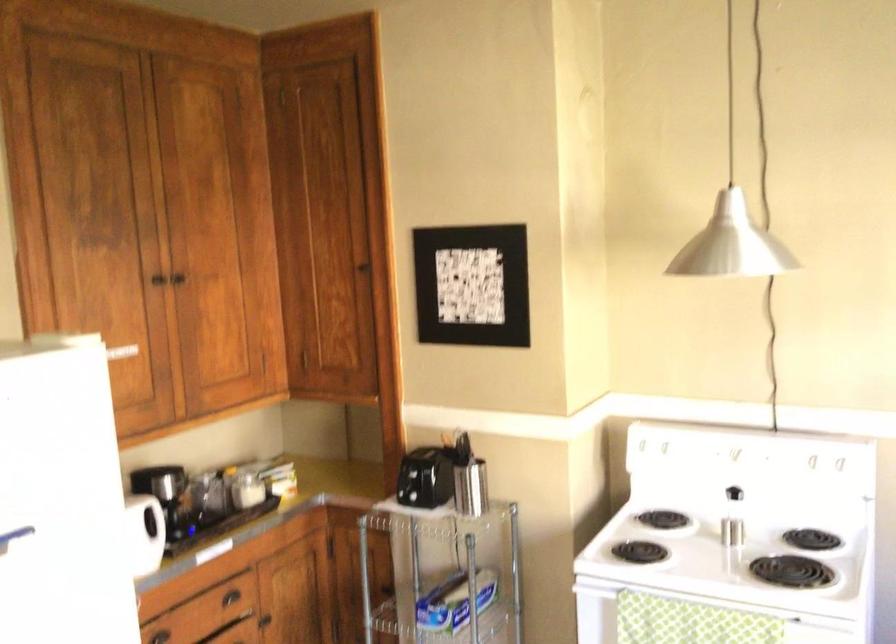
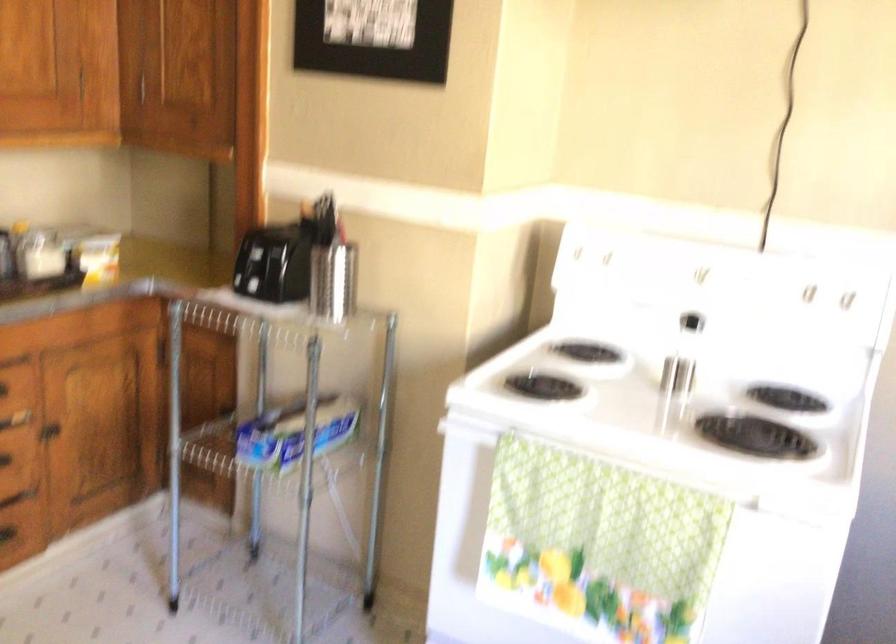
Find the pixel in the second image that matches the point at 667,446 in the first image.

(609, 257)